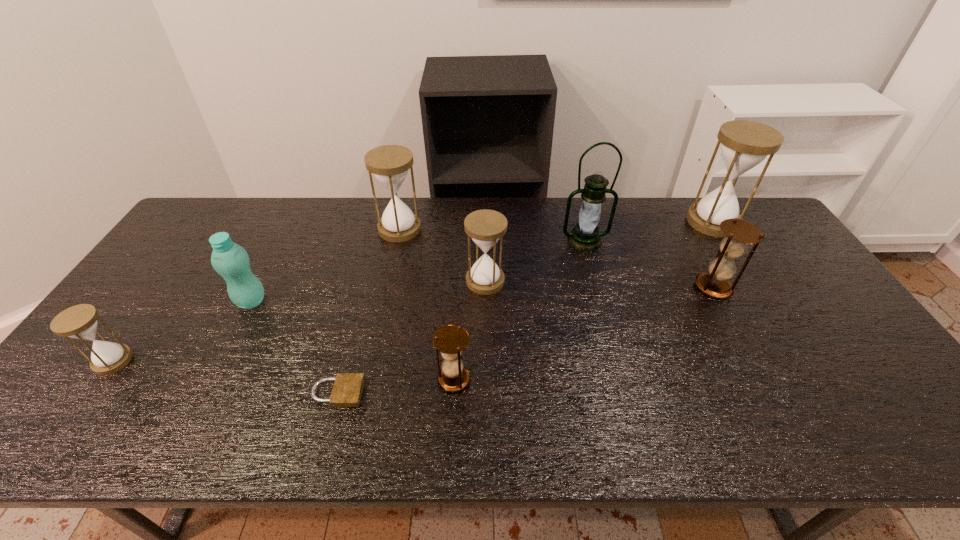
The image size is (960, 540). In order to click on vacant area situated on the back of the second white hourglass from right to left in this screenshot , I will do click(x=484, y=199).

Locate an element on the screen. vacant area situated 0.140m on the right of the farther brown hourglass is located at coordinates (780, 287).

The width and height of the screenshot is (960, 540). I want to click on vacant space located on the right of the leftmost hourglass, so click(179, 361).

At what (x,y) coordinates should I click in order to perform the action: click on free space located 0.400m on the right of the smaller brown hourglass. Please return your answer as a coordinate pair (x, y). Image resolution: width=960 pixels, height=540 pixels. Looking at the image, I should click on (637, 380).

At what (x,y) coordinates should I click in order to perform the action: click on free spot located on the keyhole side of the shortest object. Please return your answer as a coordinate pair (x, y). The height and width of the screenshot is (540, 960). Looking at the image, I should click on (x=456, y=393).

Where is `lantern that is positioned at the far edge`? The image size is (960, 540). lantern that is positioned at the far edge is located at coordinates (585, 236).

At what (x,y) coordinates should I click in order to perform the action: click on object at the left edge. Please return your answer as a coordinate pair (x, y). The image size is (960, 540). Looking at the image, I should click on (80, 322).

Identify the location of object located in the right edge section of the desktop. (745, 144).

Identify the location of object that is at the far right corner. (745, 144).

At what (x,y) coordinates should I click in order to perform the action: click on free space at the far edge. Please return your answer as a coordinate pair (x, y). This screenshot has height=540, width=960. Looking at the image, I should click on (690, 204).